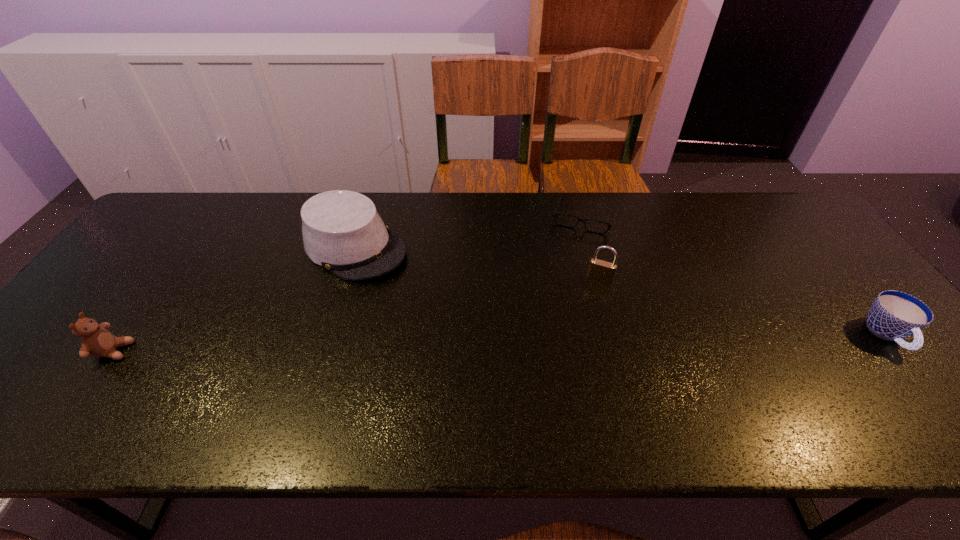
Find the location of a particular element. object located at the left edge is located at coordinates (96, 341).

Identify the location of object that is at the right edge. The image size is (960, 540). (894, 315).

The height and width of the screenshot is (540, 960). Identify the location of object located at the near left corner. (x=96, y=341).

Locate an element on the screen. vacant space at the far edge of the desktop is located at coordinates (707, 212).

Image resolution: width=960 pixels, height=540 pixels. In the image, there is a desktop. Find the location of `vacant space at the near edge`. vacant space at the near edge is located at coordinates (164, 384).

Where is `vacant space at the left edge of the desktop`? Image resolution: width=960 pixels, height=540 pixels. vacant space at the left edge of the desktop is located at coordinates (160, 244).

At what (x,y) coordinates should I click in order to perform the action: click on free point at the right edge. Please return your answer as a coordinate pair (x, y). The width and height of the screenshot is (960, 540). Looking at the image, I should click on (836, 282).

Locate an element on the screen. The height and width of the screenshot is (540, 960). free spot between the padlock and the second object from left to right is located at coordinates (477, 263).

At what (x,y) coordinates should I click in order to perform the action: click on unoccupied position between the leftmost object and the second object from left to right. Please return your answer as a coordinate pair (x, y). The height and width of the screenshot is (540, 960). Looking at the image, I should click on (234, 299).

Where is `vacant area that lies between the leftmost object and the cup`? This screenshot has height=540, width=960. vacant area that lies between the leftmost object and the cup is located at coordinates click(x=500, y=343).